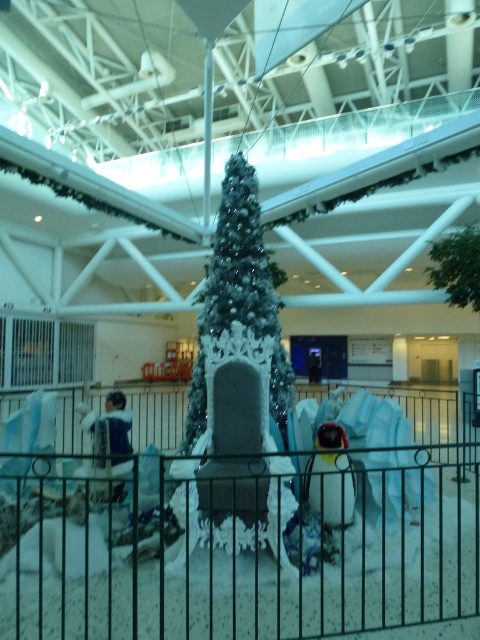
Who is more forward, (240, 208) or (472, 276)?

Point (240, 208) is in front.

At what (x,y) coordinates should I click in order to perform the action: click on white frosted christmas tree at center. Please return your answer as a coordinate pair (x, y). Looking at the image, I should click on (245, 280).

Which is above, black metal fence at center or green leafy tree at upper right?

green leafy tree at upper right

Looking at this image, is black metal fence at center wider than green leafy tree at upper right?

Yes.

Between point (129, 630) and point (439, 275), which one is positioned in front?

Point (129, 630) is in front.

Where is `black metal fence at center`? This screenshot has width=480, height=640. black metal fence at center is located at coordinates (241, 564).

I want to click on black metal fence at center, so click(241, 564).

Measure the distance between black metal fence at center and white frosted christmas tree at center.

1.95 meters

What are the coordinates of `black metal fence at center` in the screenshot? It's located at 241,564.